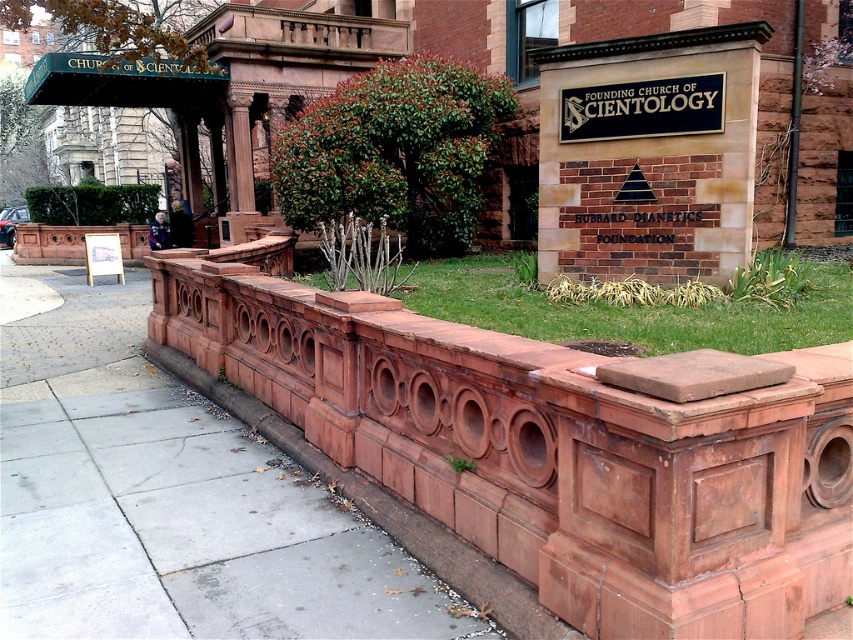
Question: Which of these objects is positioned farthest from the terracotta stone curb at lower center?

Choices:
 (A) white wood sign at center
 (B) black metal sign at upper center
 (C) green grass at center

Answer: (A)

Question: Where is black metal sign at upper center located in relation to white wood sign at center in the image?

Choices:
 (A) above
 (B) below

Answer: (A)

Question: Which of the following is the closest to the observer?

Choices:
 (A) (109, 262)
 (B) (476, 557)
 (C) (695, 330)

Answer: (B)

Question: Which object is positioned farthest from the terracotta stone curb at lower center?

Choices:
 (A) green grass at center
 (B) black metal sign at upper center

Answer: (A)

Question: Is green grass at center smaller than black metal sign at upper center?

Choices:
 (A) no
 (B) yes

Answer: (A)

Question: Does black metal sign at upper center have a larger size compared to white wood sign at center?

Choices:
 (A) yes
 (B) no

Answer: (B)